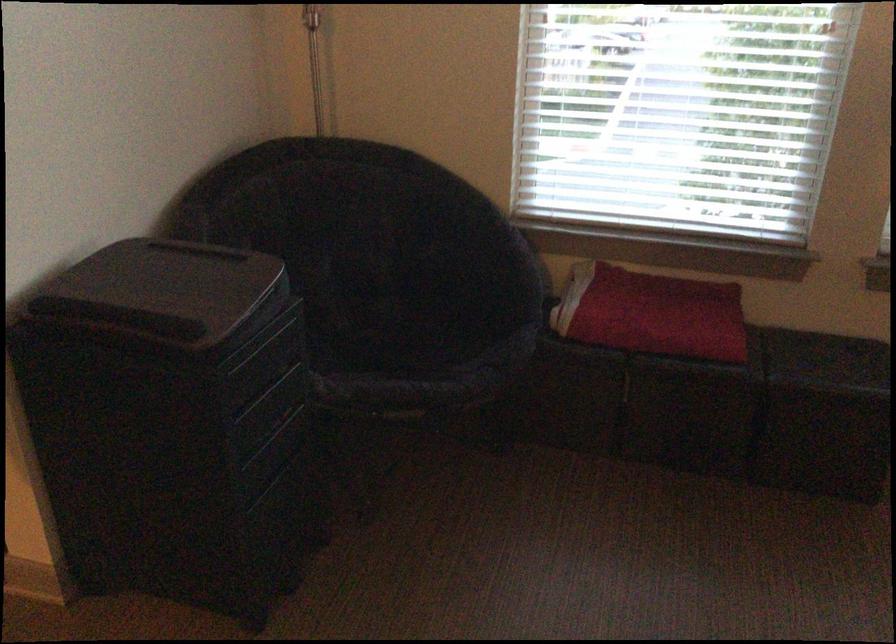
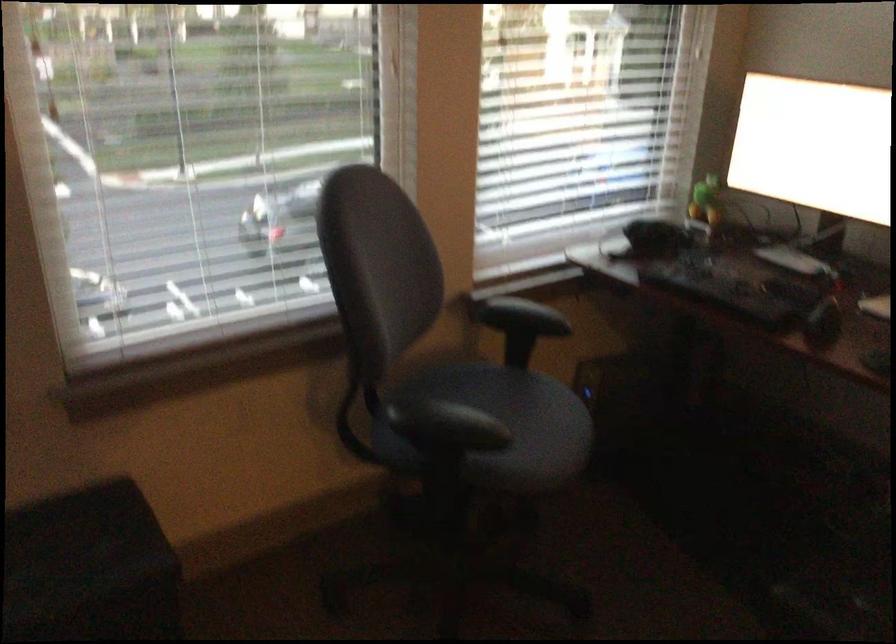
Question: The camera is either moving clockwise (left) or counter-clockwise (right) around the object. The first image is from the beginning of the video and the second image is from the end. Is the camera moving left or right when shooting the video?

Choices:
 (A) Left
 (B) Right

Answer: (A)